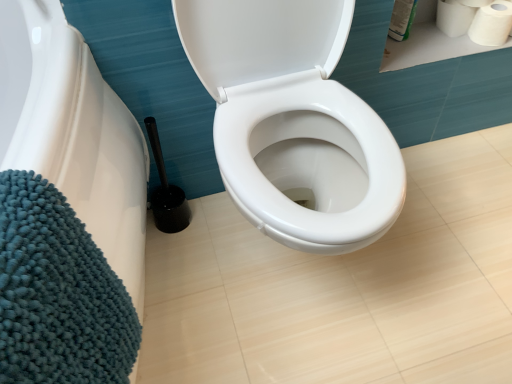
Question: Are white matte toilet paper at upper right, the 1th toilet paper positioned from the right, and black plastic toilet brush at lower left far apart?

Choices:
 (A) no
 (B) yes

Answer: (A)

Question: From a real-world perspective, is white matte toilet paper at upper right, the 1th toilet paper positioned from the right, physically above black plastic toilet brush at lower left?

Choices:
 (A) no
 (B) yes

Answer: (B)

Question: Does white matte toilet paper at upper right, which is the 2th toilet paper in left-to-right order, have a greater height compared to black plastic toilet brush at lower left?

Choices:
 (A) yes
 (B) no

Answer: (B)

Question: Is white matte toilet paper at upper right, the 1th toilet paper positioned from the right, positioned with its back to black plastic toilet brush at lower left?

Choices:
 (A) no
 (B) yes

Answer: (A)

Question: Is the depth of white matte toilet paper at upper right, the 1th toilet paper positioned from the right, less than that of black plastic toilet brush at lower left?

Choices:
 (A) no
 (B) yes

Answer: (A)

Question: From a real-world perspective, relative to white matte toilet paper at upper right, marked as the 2th toilet paper in a right-to-left arrangement, is teal plush bath mat at lower left vertically above or below?

Choices:
 (A) below
 (B) above

Answer: (B)

Question: Is teal plush bath mat at lower left taller or shorter than white matte toilet paper at upper right, marked as the 2th toilet paper in a right-to-left arrangement?

Choices:
 (A) short
 (B) tall

Answer: (B)

Question: Based on their positions, is teal plush bath mat at lower left located to the left or right of white matte toilet paper at upper right, marked as the 2th toilet paper in a right-to-left arrangement?

Choices:
 (A) left
 (B) right

Answer: (A)

Question: Considering their positions, is teal plush bath mat at lower left located in front of or behind white matte toilet paper at upper right, marked as the 2th toilet paper in a right-to-left arrangement?

Choices:
 (A) front
 (B) behind

Answer: (A)

Question: From the image's perspective, is white matte toilet paper at upper right, marked as the 2th toilet paper in a right-to-left arrangement, positioned above or below teal plush bath mat at lower left?

Choices:
 (A) above
 (B) below

Answer: (A)

Question: Is white matte toilet paper at upper right, arranged as the first toilet paper when viewed from the left, spatially inside teal plush bath mat at lower left, or outside of it?

Choices:
 (A) outside
 (B) inside

Answer: (A)

Question: Considering the positions of point (471, 1) and point (94, 94), is point (471, 1) closer or farther from the camera than point (94, 94)?

Choices:
 (A) closer
 (B) farther

Answer: (B)

Question: Considering the positions of white matte toilet paper at upper right, marked as the 2th toilet paper in a right-to-left arrangement, and teal plush bath mat at lower left in the image, is white matte toilet paper at upper right, marked as the 2th toilet paper in a right-to-left arrangement, wider or thinner than teal plush bath mat at lower left?

Choices:
 (A) thin
 (B) wide

Answer: (A)

Question: In terms of width, does teal plush bath mat at lower left look wider or thinner when compared to black plastic toilet brush at lower left?

Choices:
 (A) wide
 (B) thin

Answer: (A)

Question: In the image, is teal plush bath mat at lower left positioned in front of or behind black plastic toilet brush at lower left?

Choices:
 (A) behind
 (B) front

Answer: (B)